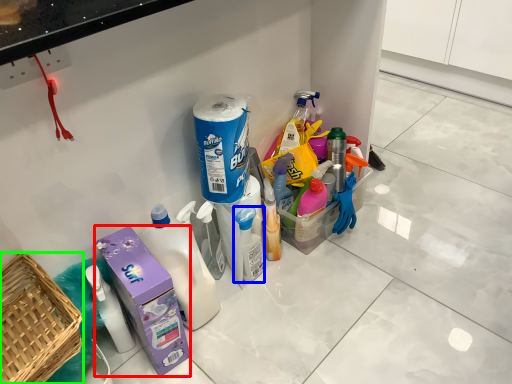
Question: Which is nearer to the carton (highlighted by a red box)? cleaning product (highlighted by a blue box) or basket (highlighted by a green box).

Choices:
 (A) cleaning product
 (B) basket

Answer: (B)